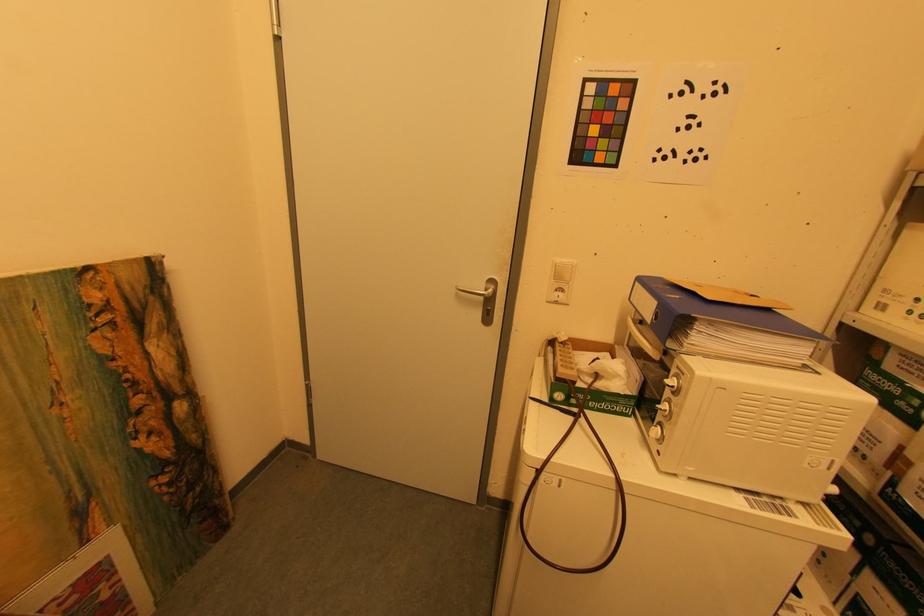
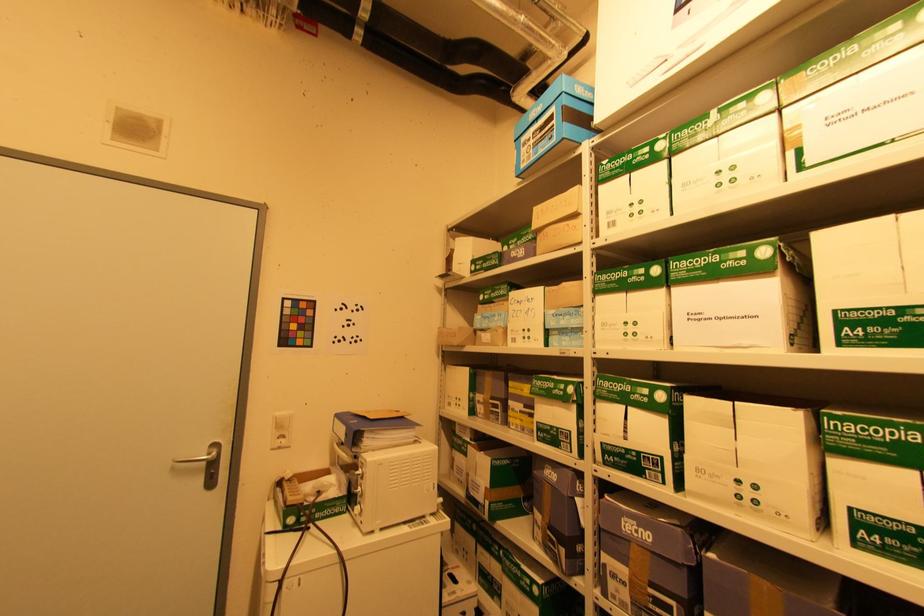
How did the camera likely rotate?

The camera rotated toward right-up.